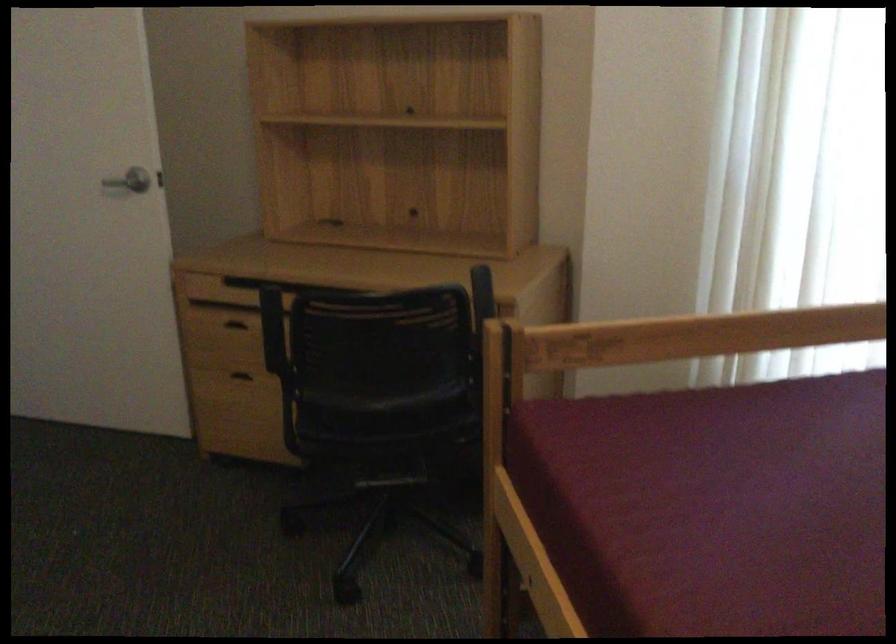
The width and height of the screenshot is (896, 644). What do you see at coordinates (383, 391) in the screenshot? I see `the chair sitting surface` at bounding box center [383, 391].